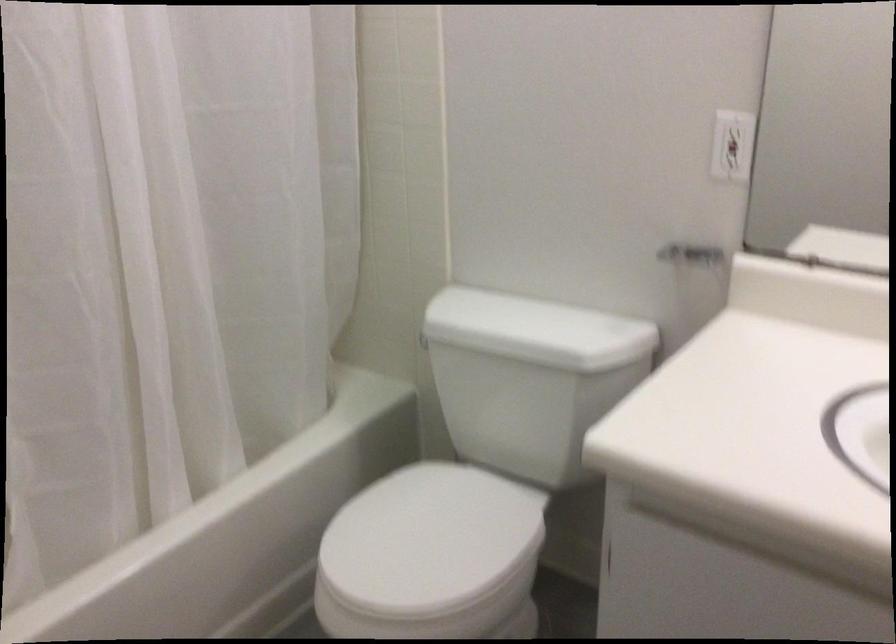
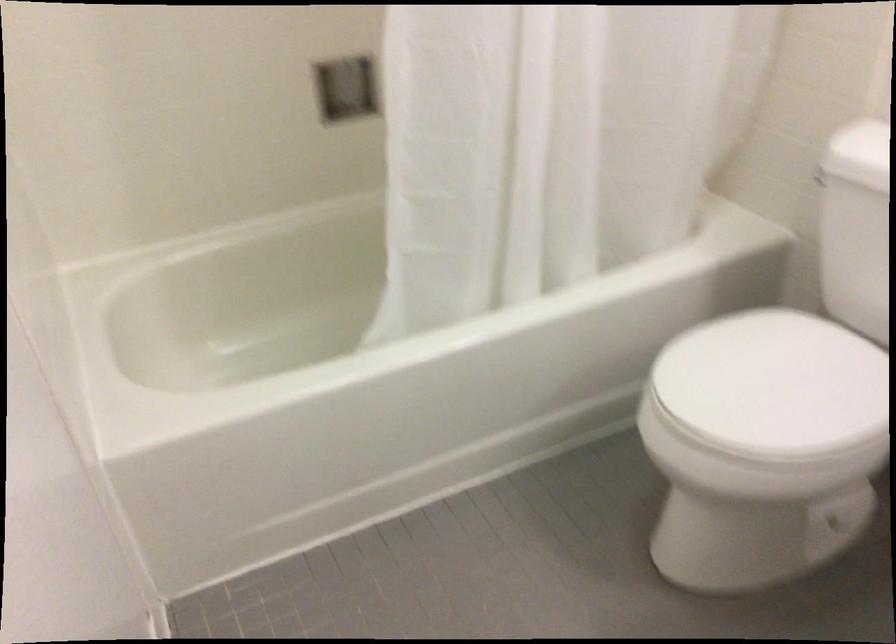
Find the pixel in the second image that matches point 427,535 in the first image.

(773, 384)